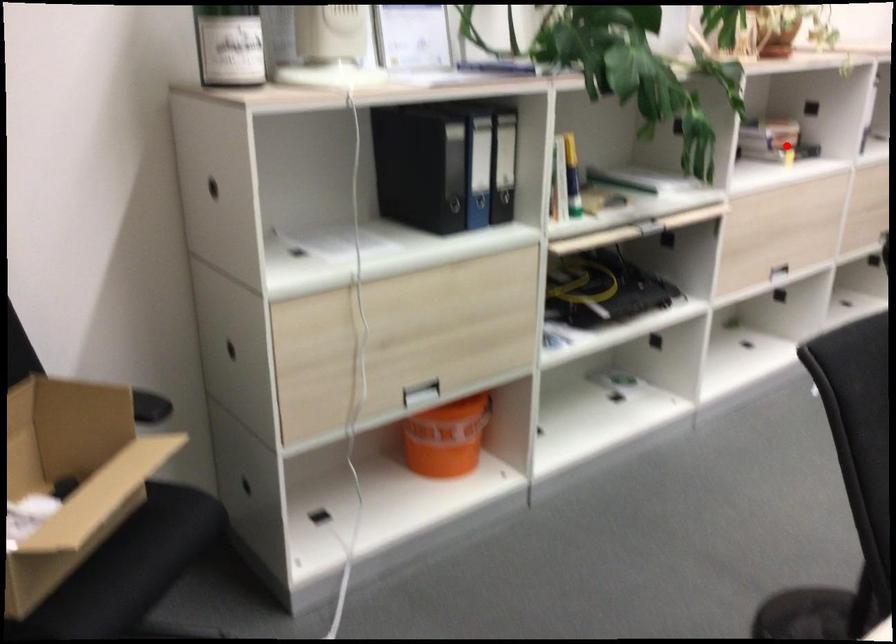
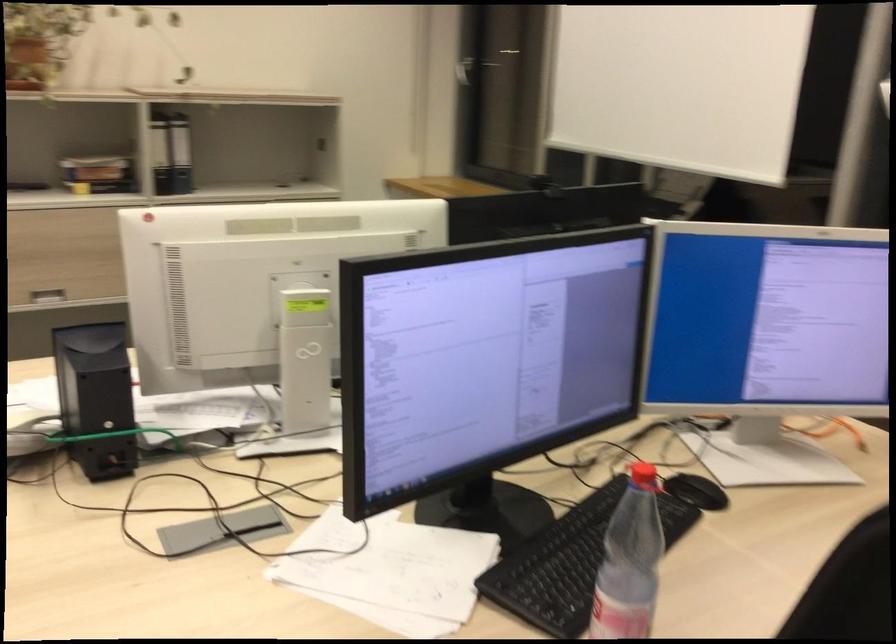
The point at the highlighted location is marked in the first image. Where is the corresponding point in the second image?

(105, 175)